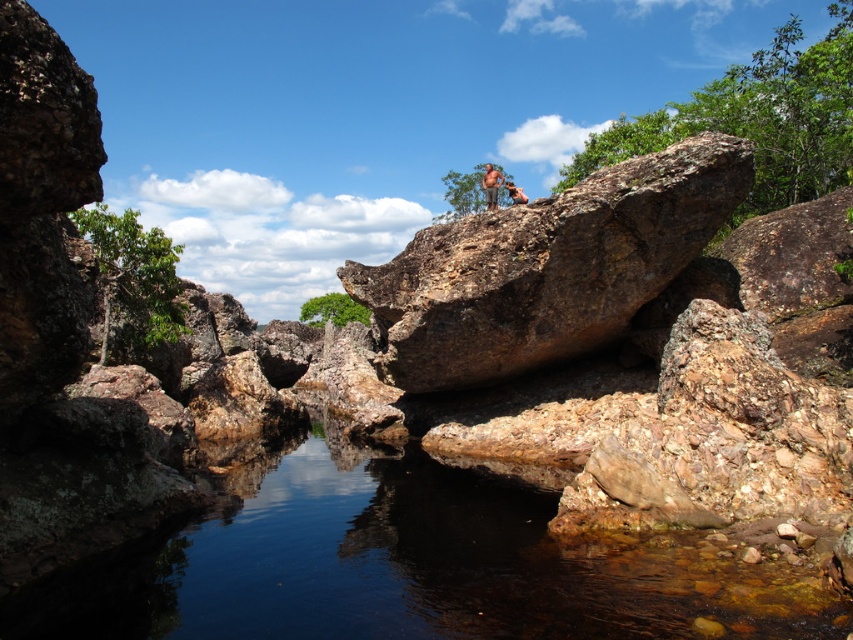
Question: Which point appears closest to the camera in this image?

Choices:
 (A) (524, 200)
 (B) (494, 177)

Answer: (A)

Question: Does clear water at center appear on the left side of brown textured shorts at upper center?

Choices:
 (A) no
 (B) yes

Answer: (B)

Question: From the image, what is the correct spatial relationship of clear water at center in relation to tan skin human at center?

Choices:
 (A) below
 (B) above

Answer: (A)

Question: Which point is closer to the camera taking this photo?

Choices:
 (A) (498, 180)
 (B) (421, 556)

Answer: (B)

Question: Based on their relative distances, which object is nearer to the tan skin human at center?

Choices:
 (A) brown textured shorts at upper center
 (B) clear water at center

Answer: (A)

Question: Can you confirm if clear water at center is positioned to the left of tan skin human at center?

Choices:
 (A) no
 (B) yes

Answer: (B)